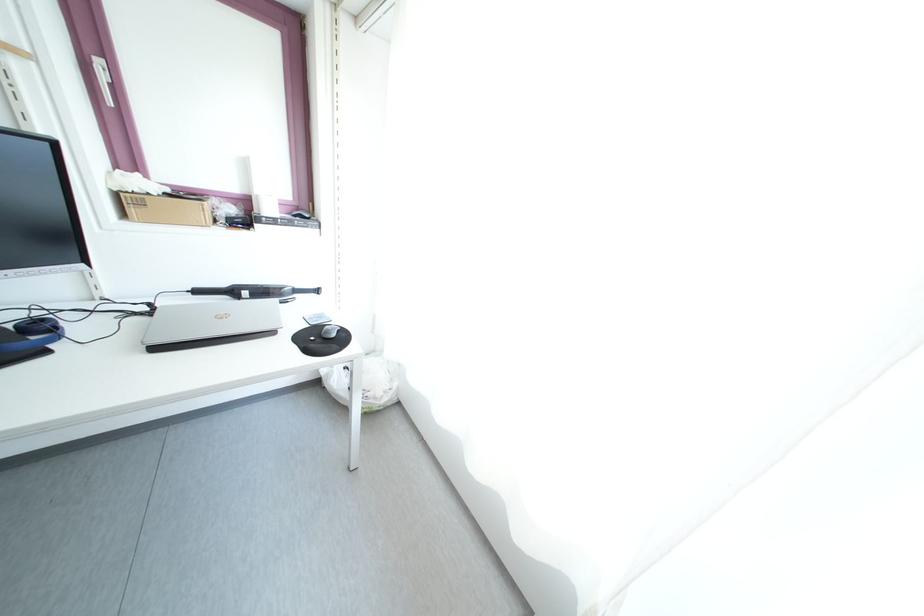
Find where to slid the computer mouse. Please return your answer as a coordinate pair (x, y).

(330, 331)